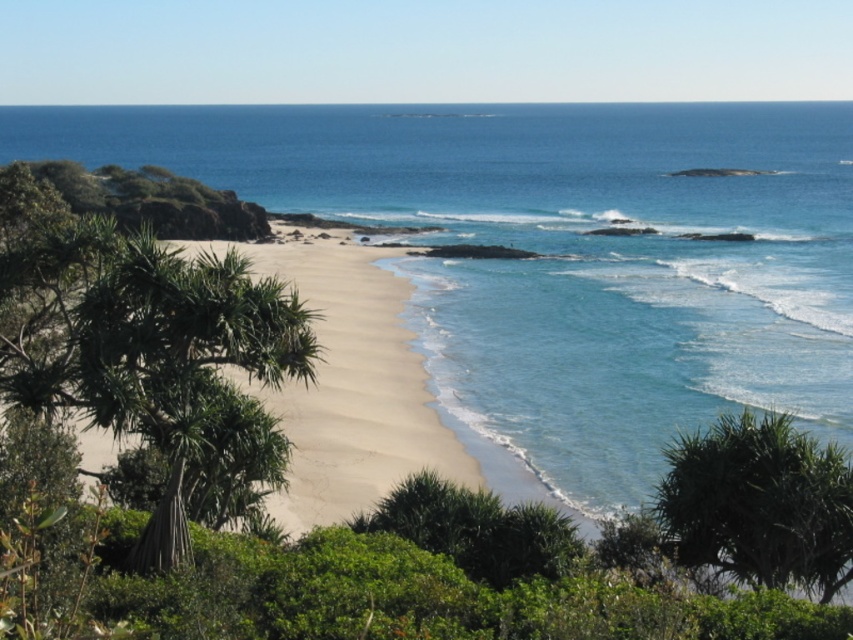
You are standing on the light beige sand at center and want to reach the blue clear water at center. Which direction should you walk to get there?

You should walk to the right because the blue clear water at center is located to the right of the light beige sand at center.

You are planning to build a small sandcastle on the light beige sand at center. However, you need to ensure that the blue clear water at center won not flood it. Based on the scene description, can you determine if the sandcastle will stay dry?

The blue clear water at center is larger in size than light beige sand at center. This means the water area is bigger, so there is a higher risk of the sandcastle being flooded by the water. Therefore, the sandcastle may not stay dry.